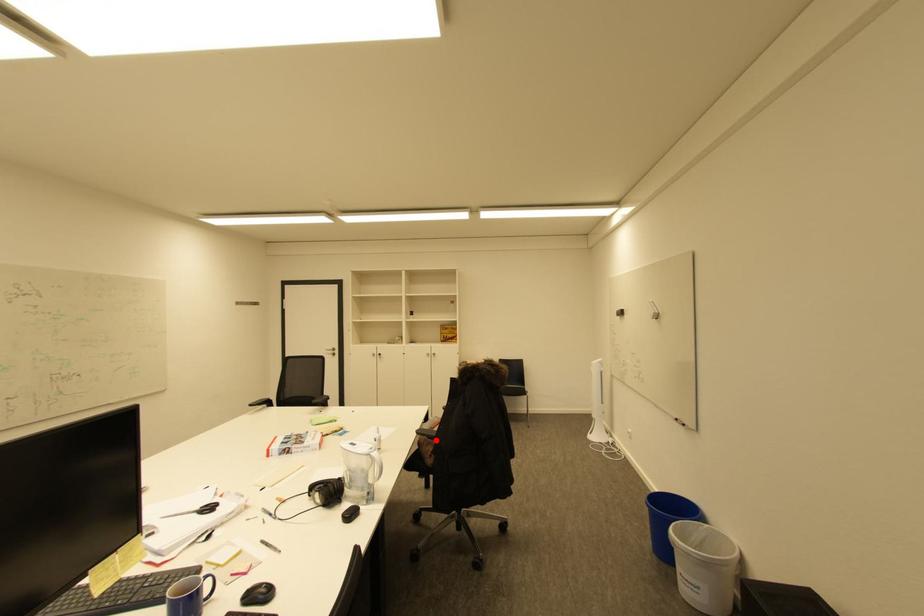
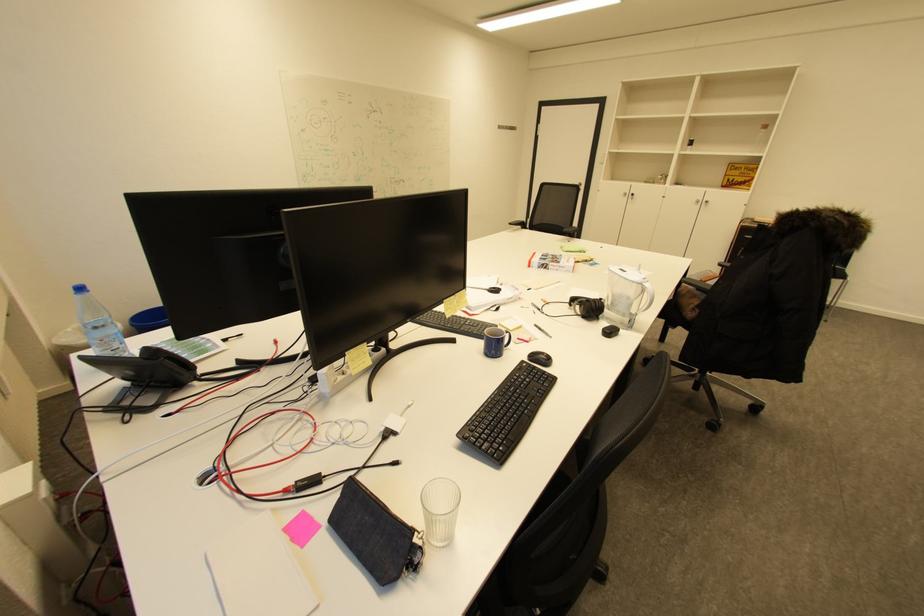
Locate, in the second image, the point that corresponds to the highlighted location in the first image.

(703, 293)